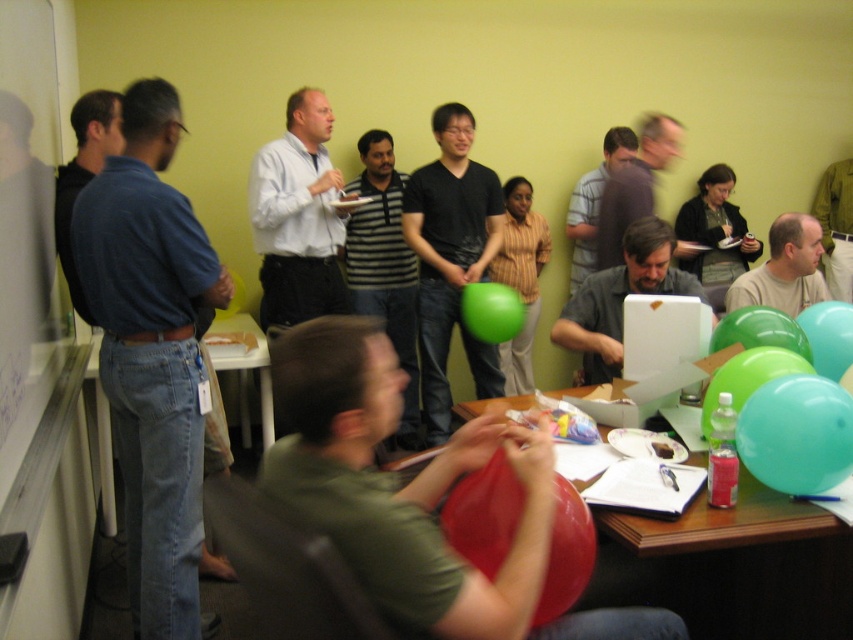
Does rubber balloon at center have a lesser height compared to teal glossy balloon at right?

In fact, rubber balloon at center may be taller than teal glossy balloon at right.

Does rubber balloon at center appear on the right side of teal glossy balloon at right?

Incorrect, rubber balloon at center is not on the right side of teal glossy balloon at right.

Does point (566, 586) come behind point (840, 337)?

No, it is in front of (840, 337).

Image resolution: width=853 pixels, height=640 pixels. I want to click on rubber balloon at center, so click(483, 515).

Describe the element at coordinates (152, 353) in the screenshot. I see `blue denim jeans at left` at that location.

Does point (91, 216) come closer to viewer compared to point (822, 444)?

No, it is not.

Is point (189, 534) positioned after point (784, 422)?

Yes, it is.

You are a GUI agent. You are given a task and a screenshot of the screen. Output one action in this format:
    pyautogui.click(x=<x>, y=<y>)
    Task: Click on the blue denim jeans at left
    The height and width of the screenshot is (640, 853).
    Given the screenshot: What is the action you would take?
    pyautogui.click(x=152, y=353)

Is wooden table at lower center further to the viewer compared to green rubber balloon at center?

That is False.

Is point (750, 488) less distant than point (492, 307)?

Yes, it is in front of point (492, 307).

Who is more forward, (730,513) or (509,332)?

Point (730,513)

At what (x,y) coordinates should I click in order to perform the action: click on wooden table at lower center. Please return your answer as a coordinate pair (x, y). Looking at the image, I should click on (730, 566).